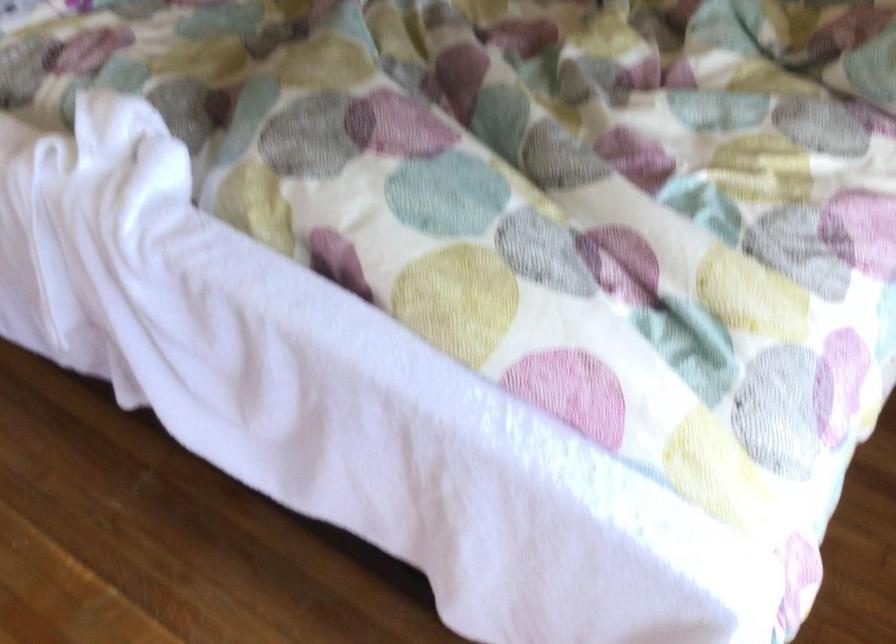
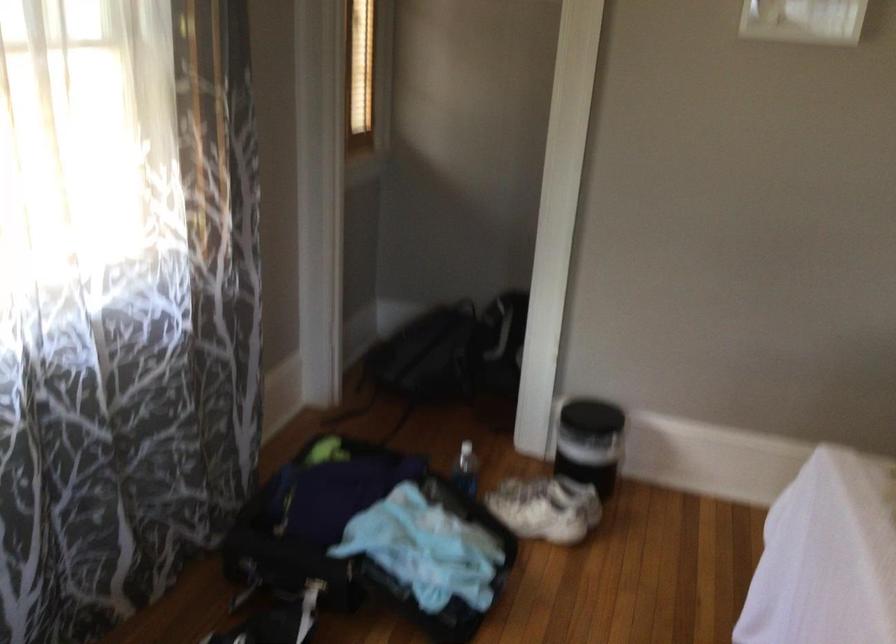
Question: The camera is either moving clockwise (left) or counter-clockwise (right) around the object. The first image is from the beginning of the video and the second image is from the end. Is the camera moving left or right when shooting the video?

Choices:
 (A) Left
 (B) Right

Answer: (B)